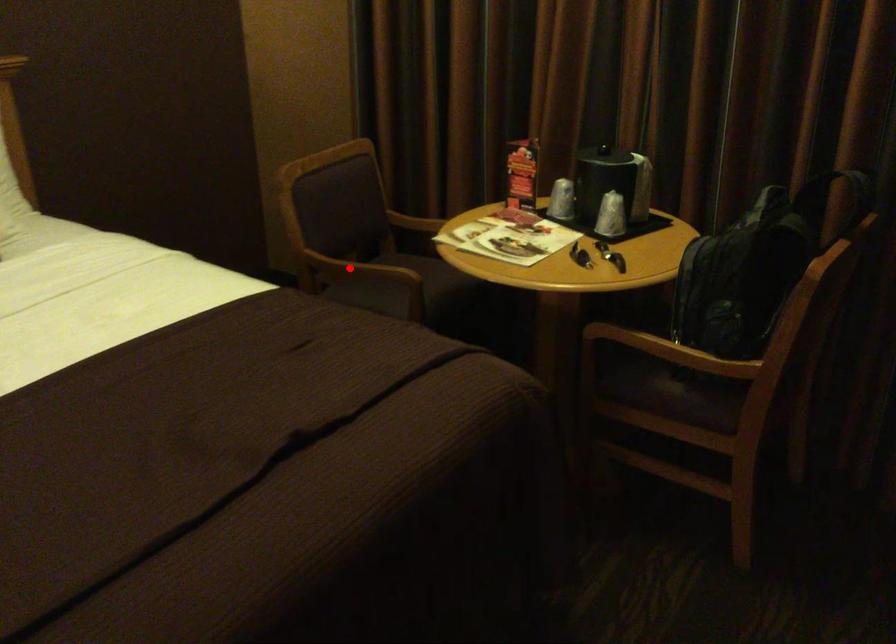
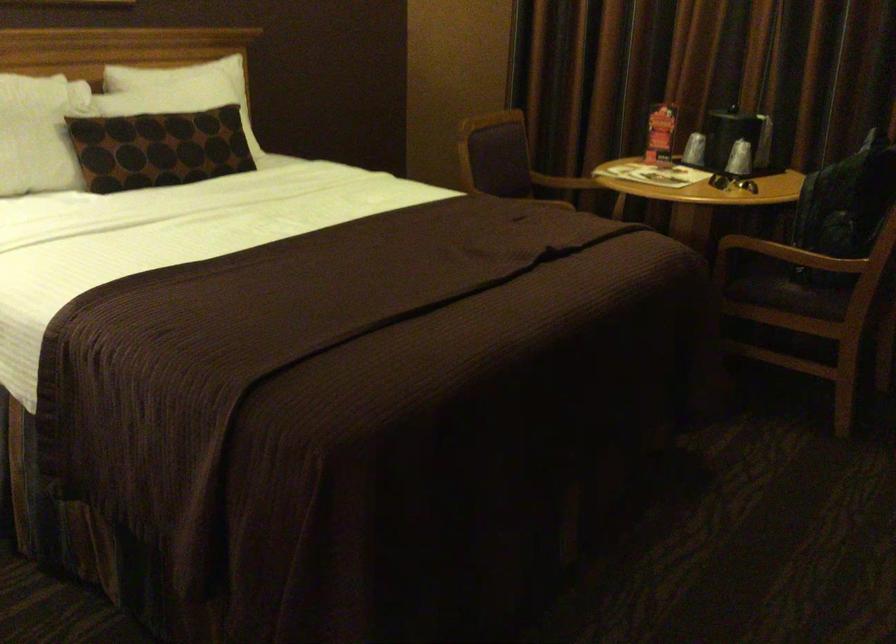
Question: I am providing you with two images of the same scene from different viewpoints. A red point is marked on the first image. Can you still see the location of the red point in image 2?

Choices:
 (A) Yes
 (B) No

Answer: (B)